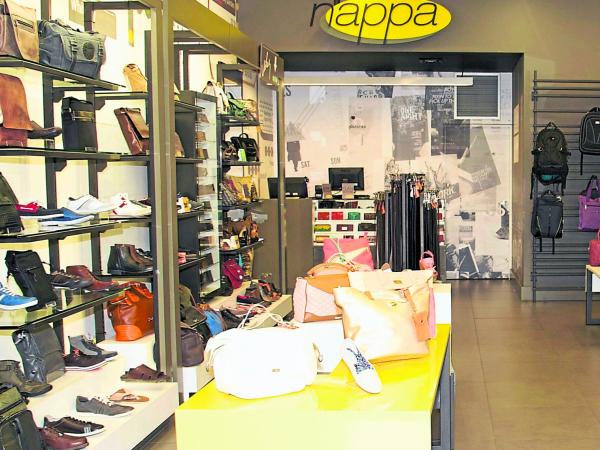
The width and height of the screenshot is (600, 450). Identify the location of floor panels. (511, 377), (520, 398), (530, 430).